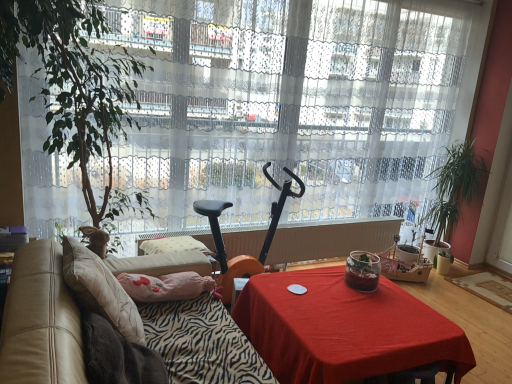
Question: In terms of height, does black plastic mobility scooter at center look taller or shorter compared to white sheer curtain at center?

Choices:
 (A) short
 (B) tall

Answer: (A)

Question: Is black plastic mobility scooter at center wider or thinner than white sheer curtain at center?

Choices:
 (A) wide
 (B) thin

Answer: (A)

Question: Which object is the closest to the leather at left?

Choices:
 (A) green leafy plant at right, the first houseplant in the right-to-left sequence
 (B) white sheer curtain at center
 (C) black plastic mobility scooter at center
 (D) beige fabric pillow at left
 (E) red fabric table at center

Answer: (D)

Question: Estimate the real-world distances between objects in this image. Which object is farther from the beige fabric pillow at left?

Choices:
 (A) zebra-patterned fabric at lower left
 (B) black plastic mobility scooter at center
 (C) leather at left
 (D) orange plastic radiator at center
 (E) white sheer curtain at center

Answer: (D)